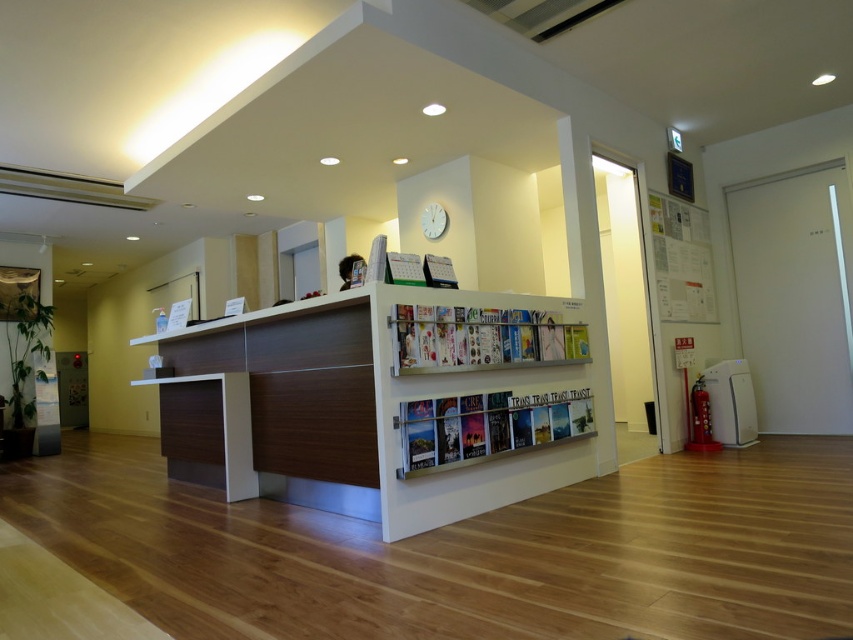
You are standing at the entrance of the office and see two points marked in the image. Which point is closer to you, point (579, 406) or point (656, 262)?

Point (579, 406) is in front of point (656, 262), so it is closer to you.

You are organizing the reception desk and need to place both the matte white book at center and the white paperboard at upper right. Which object has a greater width?

The matte white book at center has a greater width than the white paperboard at upper right.